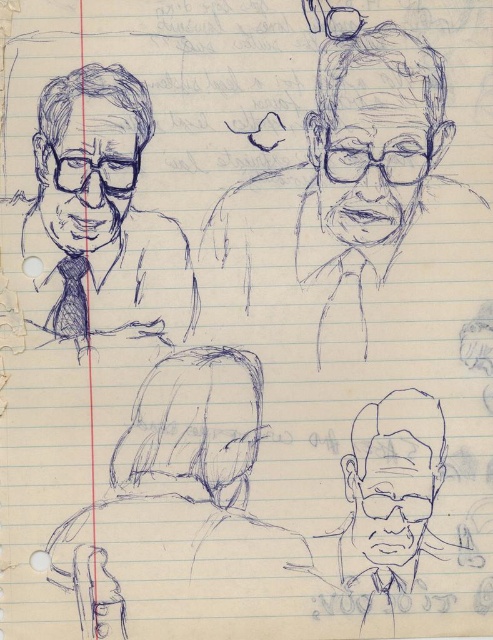
From the picture: You are an art student who needs to place a 10 inch ruler between the blue ink drawing of man at upper right and the smooth gray head at center. Can the ruler fit between them without overlapping either object?

The blue ink drawing of man at upper right is 8.66 inches from the smooth gray head at center. Since the ruler is 10 inches long, it cannot fit between them without overlapping either object because the distance is shorter than the ruler.

You are an art student who wants to add a new sketch to the notebook. You notice the graphite pencil sketch of head at upper right and the smooth gray head at center. Which one is closer to the front of the page?

The graphite pencil sketch of head at upper right is in front of smooth gray head at center, so it is closer to the front of the page.

Based on the scene description, where is the smooth gray head at center located in terms of coordinates?

The smooth gray head at center is located at point coordinates of (x=196, y=422).